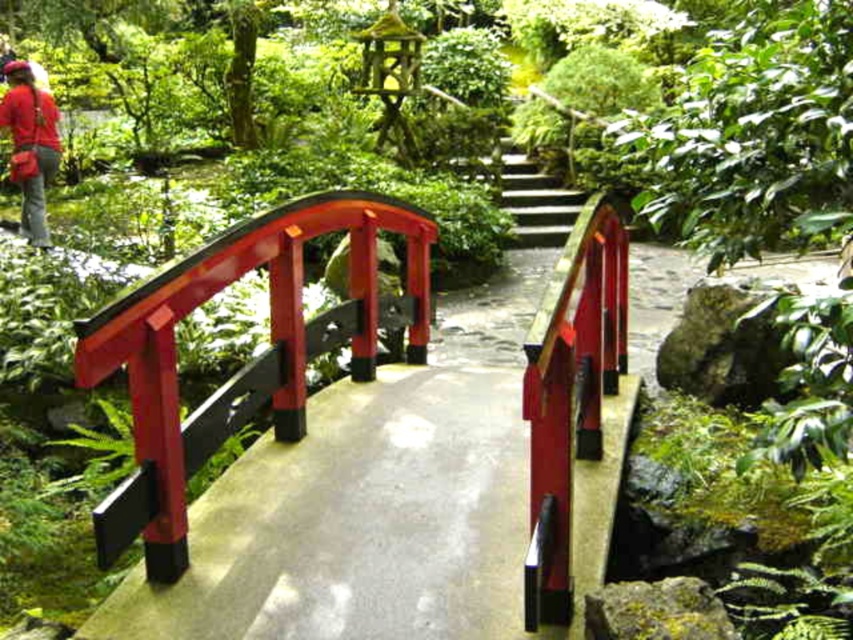
You are a painter standing at the edge of the garden. You want to paint the glossy wood bridge at center and the matte red shirt at upper left. Which object should you focus on first if you want to paint the wider one first?

The glossy wood bridge at center might be wider than matte red shirt at upper left, so you should focus on painting the glossy wood bridge at center first.

You are standing in the Japanese garden and see the glossy wood bridge at center and the matte red shirt at upper left. Which object is closer to you?

The glossy wood bridge at center is closer to you because it is in front of the matte red shirt at upper left.

You are standing in the Japanese garden and see the glossy wood bridge at center and the matte red shirt at upper left. Which object is positioned lower in the scene?

The glossy wood bridge at center is positioned lower than the matte red shirt at upper left, as it is located below it in the scene.